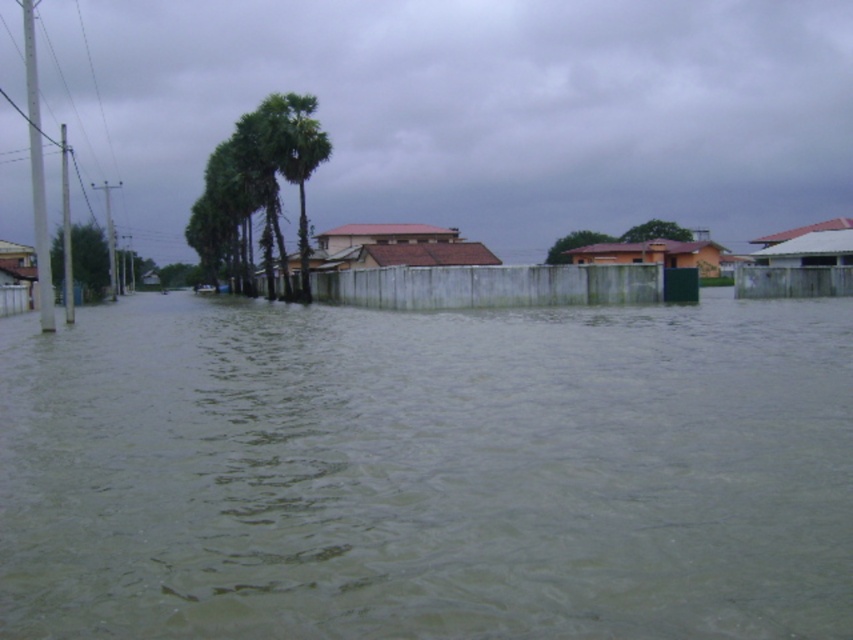
Question: Which point appears farthest from the camera in this image?

Choices:
 (A) (299, 113)
 (B) (273, 422)

Answer: (A)

Question: Which point is closer to the camera?

Choices:
 (A) (291, 141)
 (B) (514, 460)

Answer: (B)

Question: Does greenish murky water at center appear under green leafy palm trees at center?

Choices:
 (A) no
 (B) yes

Answer: (B)

Question: Does greenish murky water at center have a smaller size compared to green leafy palm trees at center?

Choices:
 (A) no
 (B) yes

Answer: (A)

Question: Can you confirm if greenish murky water at center is thinner than green leafy palm trees at center?

Choices:
 (A) yes
 (B) no

Answer: (B)